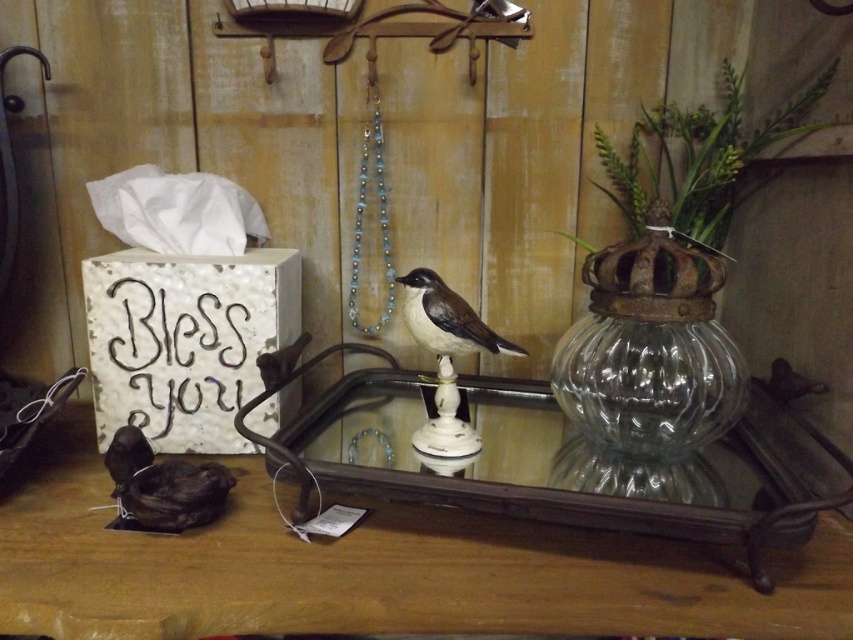
Question: Is the position of clear glass vase at center less distant than that of matte black bird at lower left?

Choices:
 (A) no
 (B) yes

Answer: (B)

Question: Does clear glass vase at center appear on the right side of brown speckled feathers at center?

Choices:
 (A) yes
 (B) no

Answer: (A)

Question: Is brown wooden table at lower center bigger than clear glass vase at center?

Choices:
 (A) yes
 (B) no

Answer: (A)

Question: Estimate the real-world distances between objects in this image. Which object is farther from the brown speckled feathers at center?

Choices:
 (A) clear glass vase at center
 (B) brown wooden table at lower center
 (C) matte black bird at lower left

Answer: (B)

Question: Which of these objects is positioned closest to the brown wooden table at lower center?

Choices:
 (A) matte black bird at lower left
 (B) brown speckled feathers at center

Answer: (A)

Question: Which is nearer to the clear glass vase at center?

Choices:
 (A) brown wooden table at lower center
 (B) matte black bird at lower left

Answer: (A)